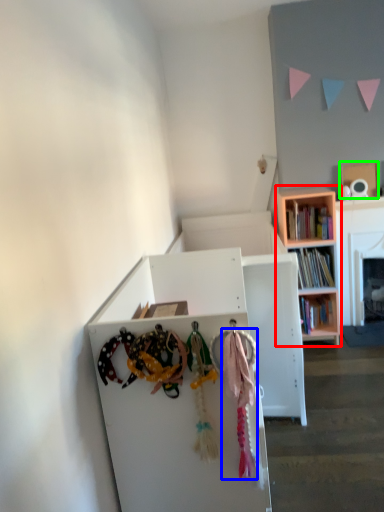
Question: Estimate the real-world distances between objects in this image. Which object is closer to bookcase (highlighted by a red box), clothesline (highlighted by a blue box) or cardboard box (highlighted by a green box)?

Choices:
 (A) clothesline
 (B) cardboard box

Answer: (B)